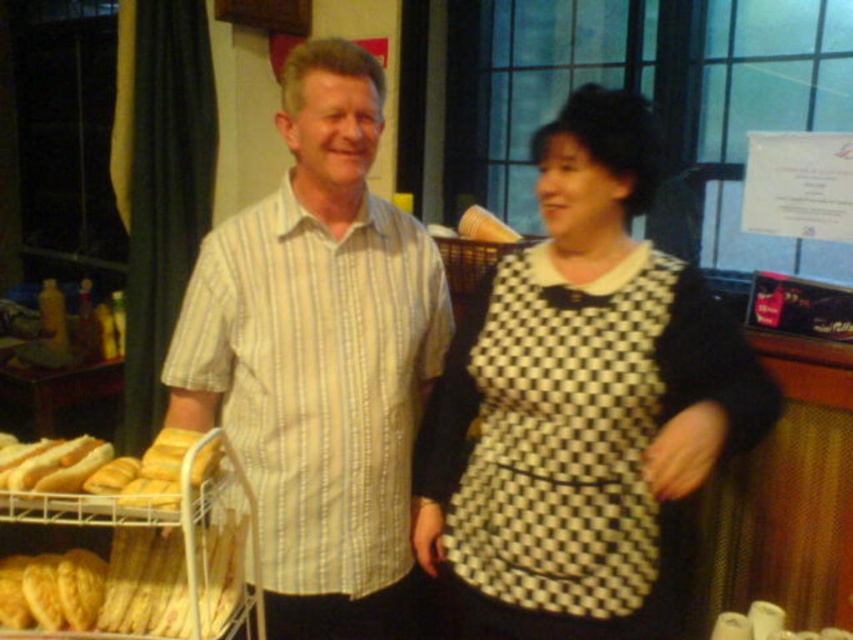
You are a photographer setting up for a group photo in a bakery. You notice the black checkered dress at center and the yellow striped shirt at center. Which clothing item is located to the right of the other?

The black checkered dress at center is positioned on the right side of yellow striped shirt at center.

You are a customer entering the bakery and want to approach the staff member who is closer to the entrance. Both staff members are wearing either the yellow striped shirt at center or the black and white checkered apron at center. Based on their positions, which staff member should you approach?

The yellow striped shirt at center is closer to you since it is further to the viewer than the black and white checkered apron at center, meaning you should approach the staff member in the yellow striped shirt at center.

You are standing in a bakery and want to take a photo of the point at coordinates [183,323]. If your camera can focus on objects within 1.5 meters, will it capture the point clearly?

The point at coordinates [183,323] is 1.43 meters away from the camera, which is within the 1.5 meters focusing range. Therefore, the camera should capture the point clearly.